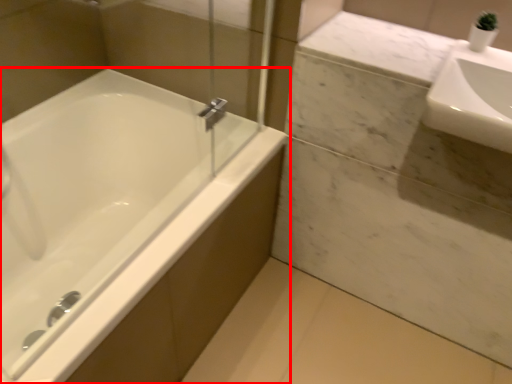
Question: From the image's perspective, where is bathtub (annotated by the red box) located relative to sink?

Choices:
 (A) above
 (B) below

Answer: (B)